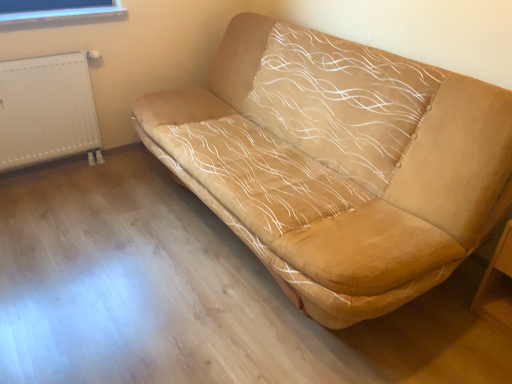
Question: Visually, is wooden table at lower right positioned to the left or to the right of white plastic radiator at left?

Choices:
 (A) left
 (B) right

Answer: (B)

Question: Is wooden table at lower right wider or thinner than white plastic radiator at left?

Choices:
 (A) wide
 (B) thin

Answer: (A)

Question: Which is nearer to the suede-like beige sofa at center?

Choices:
 (A) wooden table at lower right
 (B) white plastic radiator at left

Answer: (A)

Question: Which of these objects is positioned farthest from the white plastic radiator at left?

Choices:
 (A) suede-like beige sofa at center
 (B) wooden table at lower right

Answer: (B)